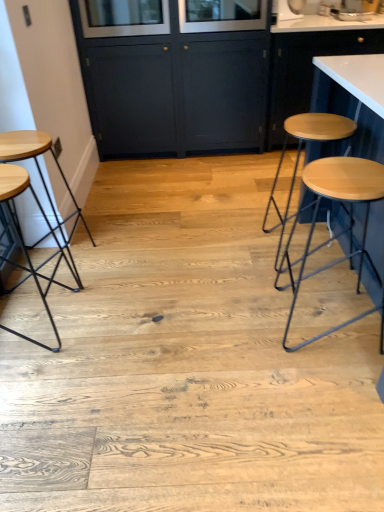
Find the location of a particular element. The height and width of the screenshot is (512, 384). vacant space situated above wooden stool at right, the second stool positioned from the left (from a real-world perspective) is located at coordinates click(x=339, y=178).